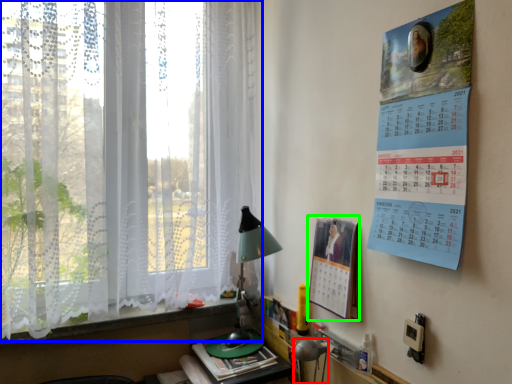
Question: Which object is positioned farthest from table lamp (highlighted by a red box)? Select from window (highlighted by a blue box) and poster page (highlighted by a green box).

Choices:
 (A) window
 (B) poster page

Answer: (A)